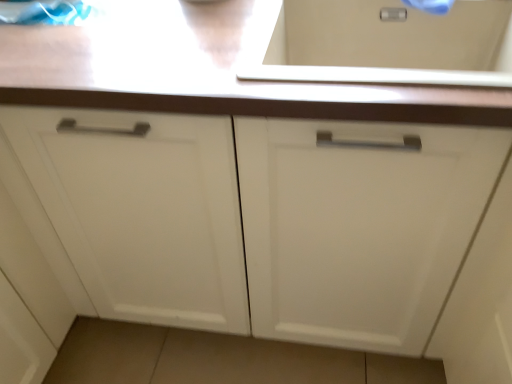
This screenshot has width=512, height=384. Describe the element at coordinates (258, 220) in the screenshot. I see `white matte cabinet at center` at that location.

Find the location of a particular element. Image resolution: width=512 pixels, height=384 pixels. white matte cabinet at center is located at coordinates click(x=258, y=220).

You are a GUI agent. You are given a task and a screenshot of the screen. Output one action in this format:
    pyautogui.click(x=<x>, y=<y>)
    Task: Click on the white matte cabinet at center
    The image size is (512, 384).
    Given the screenshot: What is the action you would take?
    pyautogui.click(x=258, y=220)